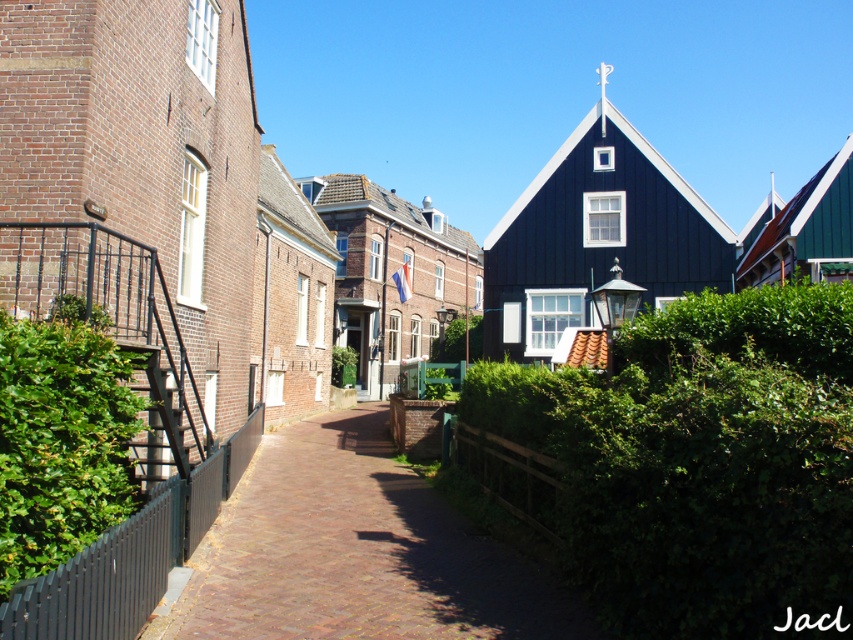
You are standing at the entrance of the brick building on the left. You want to walk to the brick textured church at center without crossing the street. Can you reach it by staying on the same side as the green leafy hedge at center?

The green leafy hedge at center is 34.21 meters away from the brick textured church at center. Since the hedge is on the same side as the church, you can walk along this side to reach the brick textured church at center without crossing the street.

In the scene shown: You are standing on the cobblestone street in the center of the image and want to take a photo of the black wooden house at center and the green leafy hedge at left. Which object should you focus on first if you want both to be in sharp focus?

The green leafy hedge at left is behind the black wooden house at center, so you should focus on the black wooden house at center first to ensure both are in sharp focus.